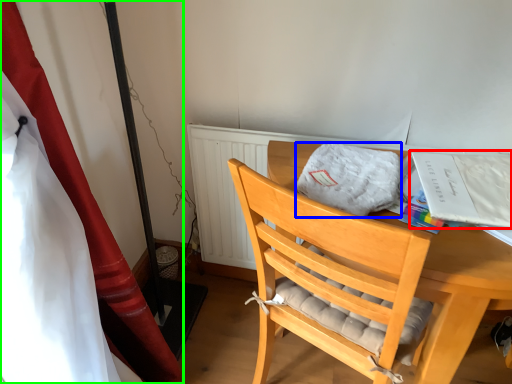
Question: Which object is positioned farthest from magazine (highlighted by a red box)? Select from cloth (highlighted by a blue box) and curtain (highlighted by a green box).

Choices:
 (A) cloth
 (B) curtain

Answer: (B)